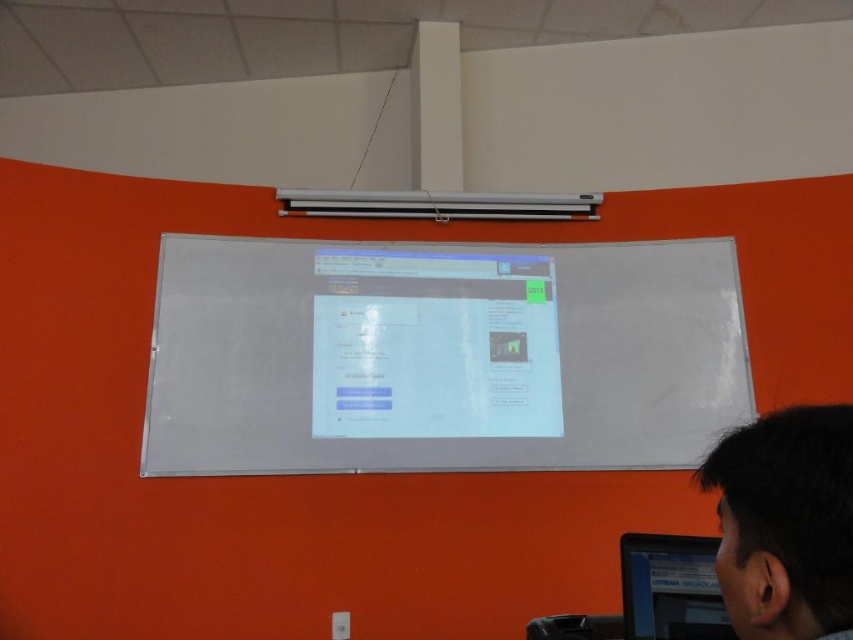
You are a student sitting at the back of the classroom. You notice two items at the lower right corner of the whiteboard area. Which item is taller between the dark hair at lower right and the black glossy monitor at lower right?

The black glossy monitor at lower right is taller than the dark hair at lower right.

You are a student sitting at the back of the classroom and want to see the black glossy monitor at lower right. The dark hair at lower right is blocking your view. Can you estimate whether the dark hair is wider than the monitor?

The dark hair at lower right is narrower than the black glossy monitor at lower right, so the hair is blocking part of the monitor but not its entire width. You might need to move slightly to the side to see the full monitor.

You are a photographer standing in the room and want to take a photo of the white matte board at center. Your camera has a minimum focusing distance of 2 meters. Can you take a clear photo without moving closer?

The white matte board at center and camera are 2.52 meters apart. Since the minimum focusing distance is 2 meters, the camera can focus at 2.52 meters, so yes, you can take a clear photo without moving closer.